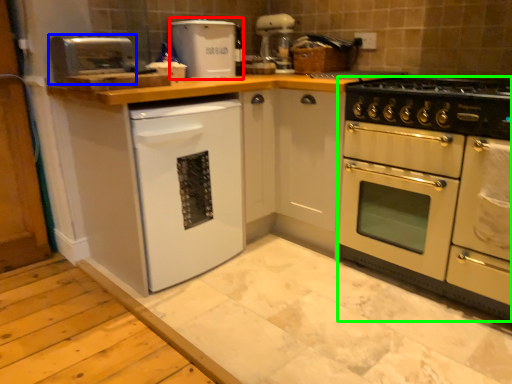
Question: Considering the real-world distances, which object is farthest from appliance (highlighted by a red box)? appliance (highlighted by a blue box) or oven (highlighted by a green box)?

Choices:
 (A) appliance
 (B) oven

Answer: (B)